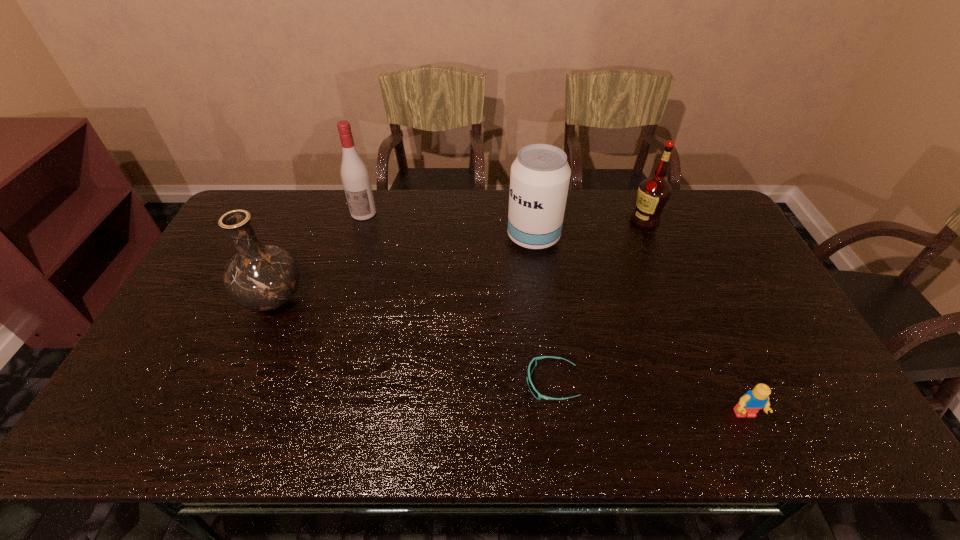
Locate an element on the screen. Image resolution: width=960 pixels, height=540 pixels. the second object from left to right is located at coordinates (355, 177).

At what (x,y) coordinates should I click in order to perform the action: click on the rightmost alcohol. Please return your answer as a coordinate pair (x, y). This screenshot has width=960, height=540. Looking at the image, I should click on (654, 192).

Where is `the second alcohol from left to right`? Image resolution: width=960 pixels, height=540 pixels. the second alcohol from left to right is located at coordinates (540, 175).

Locate an element on the screen. The height and width of the screenshot is (540, 960). the leftmost object is located at coordinates (261, 277).

Locate an element on the screen. This screenshot has height=540, width=960. vase is located at coordinates click(x=261, y=277).

Locate an element on the screen. Lego is located at coordinates (750, 403).

Where is `the second shortest object`? The height and width of the screenshot is (540, 960). the second shortest object is located at coordinates (750, 403).

Find the location of a particular element. Image resolution: width=960 pixels, height=540 pixels. the shortest object is located at coordinates (533, 363).

This screenshot has width=960, height=540. In order to click on the fifth farthest object in this screenshot , I will do `click(533, 363)`.

The width and height of the screenshot is (960, 540). I want to click on vacant space located on the label of the second object from left to right, so click(x=335, y=308).